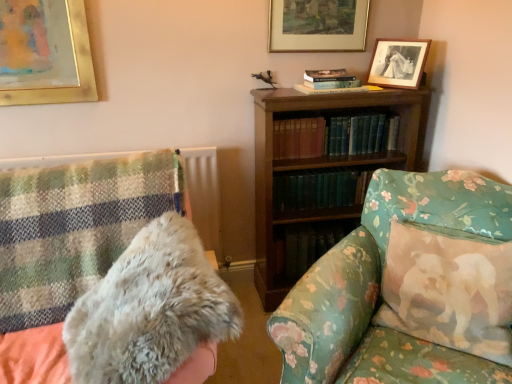
Question: Does green hardcover books at center, placed as the first book when sorted from bottom to top, have a lesser height compared to floral fabric couch at center?

Choices:
 (A) no
 (B) yes

Answer: (B)

Question: Is floral fabric couch at center located within green hardcover books at center, positioned as the 2th book in top-to-bottom order?

Choices:
 (A) yes
 (B) no

Answer: (B)

Question: Considering the relative sizes of green hardcover books at center, positioned as the 2th book in top-to-bottom order, and floral fabric couch at center in the image provided, is green hardcover books at center, positioned as the 2th book in top-to-bottom order, thinner than floral fabric couch at center?

Choices:
 (A) yes
 (B) no

Answer: (A)

Question: From a real-world perspective, is green hardcover books at center, positioned as the 2th book in top-to-bottom order, positioned over floral fabric couch at center based on gravity?

Choices:
 (A) yes
 (B) no

Answer: (A)

Question: Does green hardcover books at center, placed as the first book when sorted from bottom to top, have a greater width compared to floral fabric couch at center?

Choices:
 (A) no
 (B) yes

Answer: (A)

Question: In terms of height, does gold-framed picture at upper center, marked as the 1th picture frame in a left-to-right arrangement, look taller or shorter compared to floral fabric couch at center?

Choices:
 (A) short
 (B) tall

Answer: (A)

Question: In terms of width, does gold-framed picture at upper center, marked as the 1th picture frame in a left-to-right arrangement, look wider or thinner when compared to floral fabric couch at center?

Choices:
 (A) wide
 (B) thin

Answer: (B)

Question: Is gold-framed picture at upper center, the second picture frame in the right-to-left sequence, inside or outside of floral fabric couch at center?

Choices:
 (A) outside
 (B) inside

Answer: (A)

Question: From the image's perspective, is gold-framed picture at upper center, the second picture frame in the right-to-left sequence, above or below floral fabric couch at center?

Choices:
 (A) below
 (B) above

Answer: (B)

Question: In terms of size, does black matte picture frame at upper right, placed as the first picture frame when sorted from right to left, appear bigger or smaller than green hardcover books at center, positioned as the 2th book in top-to-bottom order?

Choices:
 (A) small
 (B) big

Answer: (A)

Question: From the image's perspective, is black matte picture frame at upper right, placed as the first picture frame when sorted from right to left, positioned above or below green hardcover books at center, placed as the first book when sorted from bottom to top?

Choices:
 (A) above
 (B) below

Answer: (A)

Question: Is point (400, 69) closer or farther from the camera than point (355, 195)?

Choices:
 (A) closer
 (B) farther

Answer: (A)

Question: Considering their positions, is black matte picture frame at upper right, placed as the first picture frame when sorted from right to left, located in front of or behind green hardcover books at center, positioned as the 2th book in top-to-bottom order?

Choices:
 (A) front
 (B) behind

Answer: (A)

Question: Considering the positions of point (458, 317) and point (356, 296), is point (458, 317) closer or farther from the camera than point (356, 296)?

Choices:
 (A) farther
 (B) closer

Answer: (B)

Question: Is fluffy cotton pillow at right wider or thinner than floral fabric couch at center?

Choices:
 (A) wide
 (B) thin

Answer: (B)